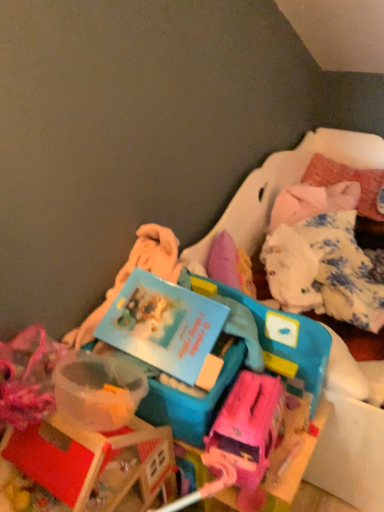
Question: Which direction should I rotate to look at blue plastic storage box at center, which is the second storage box in right-to-left order?

Choices:
 (A) left
 (B) right

Answer: (A)

Question: Can you confirm if blue plastic storage box at center, which ranks as the second storage box in left-to-right order, is shorter than blue plastic storage box at center, which is the second storage box in right-to-left order?

Choices:
 (A) yes
 (B) no

Answer: (B)

Question: From a real-world perspective, is blue plastic storage box at center, which ranks as the second storage box in left-to-right order, under blue plastic storage box at center, which is counted as the 1th storage box, starting from the left?

Choices:
 (A) no
 (B) yes

Answer: (A)

Question: Is blue plastic storage box at center, which ranks as the 1th storage box in right-to-left order, positioned far away from blue plastic storage box at center, which is the second storage box in right-to-left order?

Choices:
 (A) no
 (B) yes

Answer: (A)

Question: Considering the relative sizes of blue plastic storage box at center, which ranks as the 1th storage box in right-to-left order, and blue plastic storage box at center, which is counted as the 1th storage box, starting from the left, in the image provided, is blue plastic storage box at center, which ranks as the 1th storage box in right-to-left order, wider than blue plastic storage box at center, which is counted as the 1th storage box, starting from the left,?

Choices:
 (A) no
 (B) yes

Answer: (B)

Question: Is blue plastic storage box at center, which is counted as the 1th storage box, starting from the left, at the back of blue plastic storage box at center, which ranks as the 1th storage box in right-to-left order?

Choices:
 (A) yes
 (B) no

Answer: (B)

Question: Is blue plastic storage box at center, which ranks as the 1th storage box in right-to-left order, in front of blue plastic storage box at center, which is the second storage box in right-to-left order?

Choices:
 (A) yes
 (B) no

Answer: (B)

Question: From the image's perspective, is blue plastic storage box at center, which ranks as the second storage box in left-to-right order, beneath matte pink suitcase at center?

Choices:
 (A) no
 (B) yes

Answer: (A)

Question: Is matte pink suitcase at center completely or partially inside blue plastic storage box at center, which ranks as the second storage box in left-to-right order?

Choices:
 (A) yes
 (B) no

Answer: (B)

Question: Is blue plastic storage box at center, which ranks as the second storage box in left-to-right order, further to the viewer compared to matte pink suitcase at center?

Choices:
 (A) no
 (B) yes

Answer: (B)

Question: Is blue plastic storage box at center, which ranks as the 1th storage box in right-to-left order, bigger than matte pink suitcase at center?

Choices:
 (A) yes
 (B) no

Answer: (A)

Question: Considering the relative sizes of blue plastic storage box at center, which ranks as the second storage box in left-to-right order, and matte pink suitcase at center in the image provided, is blue plastic storage box at center, which ranks as the second storage box in left-to-right order, thinner than matte pink suitcase at center?

Choices:
 (A) yes
 (B) no

Answer: (B)

Question: Is blue plastic storage box at center, which ranks as the 1th storage box in right-to-left order, located outside matte pink suitcase at center?

Choices:
 (A) no
 (B) yes

Answer: (B)

Question: Is blue plastic book at center facing towards matte pink suitcase at center?

Choices:
 (A) no
 (B) yes

Answer: (A)